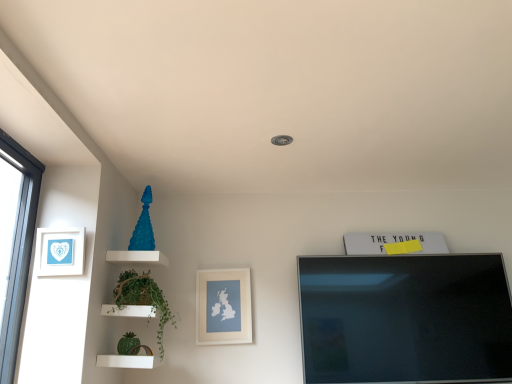
Question: Does matte white picture frame at center, acting as the 2th picture frame starting from the top, have a larger size compared to green leafy plant at left?

Choices:
 (A) no
 (B) yes

Answer: (A)

Question: From the image's perspective, does matte white picture frame at center, the 1th picture frame in the back-to-front sequence, appear higher than green leafy plant at left?

Choices:
 (A) yes
 (B) no

Answer: (B)

Question: Is matte white picture frame at center, acting as the 2th picture frame starting from the top, in contact with green leafy plant at left?

Choices:
 (A) no
 (B) yes

Answer: (A)

Question: From a real-world perspective, is matte white picture frame at center, acting as the 2th picture frame starting from the top, below green leafy plant at left?

Choices:
 (A) no
 (B) yes

Answer: (A)

Question: Is matte white picture frame at center, the 1th picture frame in the back-to-front sequence, to the left of green leafy plant at left from the viewer's perspective?

Choices:
 (A) no
 (B) yes

Answer: (A)

Question: Is matte white picture frame at center, the 1th picture frame in the back-to-front sequence, taller or shorter than green leafy plant at left?

Choices:
 (A) short
 (B) tall

Answer: (A)

Question: Is matte white picture frame at center, acting as the 2th picture frame starting from the top, wider or thinner than green leafy plant at left?

Choices:
 (A) thin
 (B) wide

Answer: (A)

Question: From the image's perspective, is matte white picture frame at center, the 2th picture frame from the front, located above or below green leafy plant at left?

Choices:
 (A) below
 (B) above

Answer: (A)

Question: Considering their positions, is matte white picture frame at center, acting as the 2th picture frame starting from the top, located in front of or behind green leafy plant at left?

Choices:
 (A) behind
 (B) front

Answer: (A)

Question: Is green leafy plant at left wider or thinner than matte white picture frame at center, which is the first picture frame in bottom-to-top order?

Choices:
 (A) thin
 (B) wide

Answer: (B)

Question: In terms of height, does green leafy plant at left look taller or shorter compared to matte white picture frame at center, the 2th picture frame from the front?

Choices:
 (A) tall
 (B) short

Answer: (A)

Question: From the image's perspective, is green leafy plant at left positioned above or below matte white picture frame at center, acting as the 2th picture frame starting from the top?

Choices:
 (A) above
 (B) below

Answer: (A)

Question: Is point (145, 299) closer or farther from the camera than point (233, 274)?

Choices:
 (A) closer
 (B) farther

Answer: (A)

Question: Is green leafy plant at left wider or thinner than white paper at left, which is the first picture frame in top-to-bottom order?

Choices:
 (A) thin
 (B) wide

Answer: (B)

Question: From a real-world perspective, is green leafy plant at left physically located above or below white paper at left, marked as the 2th picture frame in a back-to-front arrangement?

Choices:
 (A) above
 (B) below

Answer: (B)